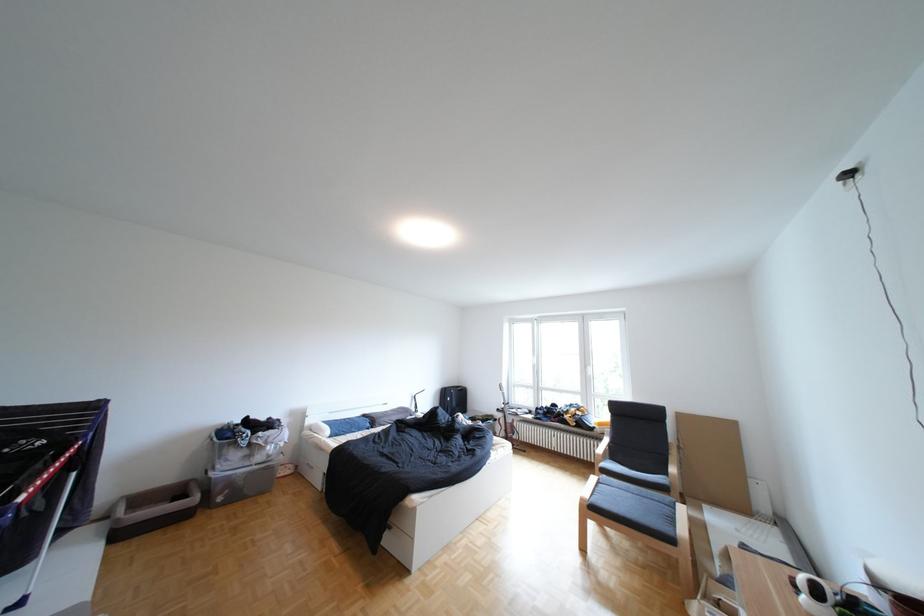
The image size is (924, 616). I want to click on chair sitting surface, so click(x=635, y=508).